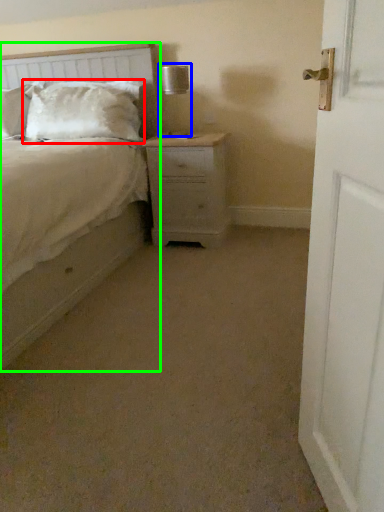
Question: Estimate the real-world distances between objects in this image. Which object is closer to pillow (highlighted by a red box), table lamp (highlighted by a blue box) or bed (highlighted by a green box)?

Choices:
 (A) table lamp
 (B) bed

Answer: (A)